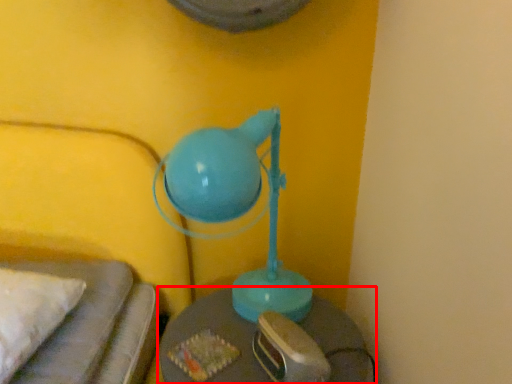
Question: Considering the relative positions of table (annotated by the red box) and lamp in the image provided, where is table (annotated by the red box) located with respect to the staircase?

Choices:
 (A) right
 (B) left

Answer: (A)